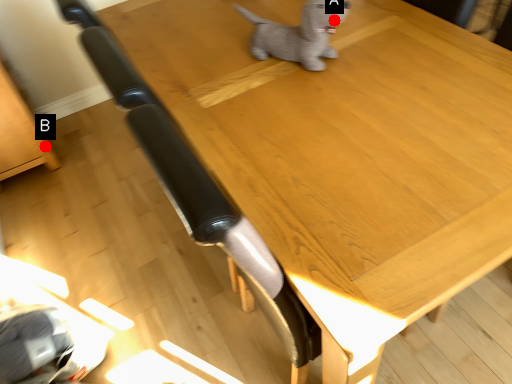
Question: Two points are circled on the image, labeled by A and B beside each circle. Which point appears closest to the camera in this image?

Choices:
 (A) A is closer
 (B) B is closer

Answer: (A)